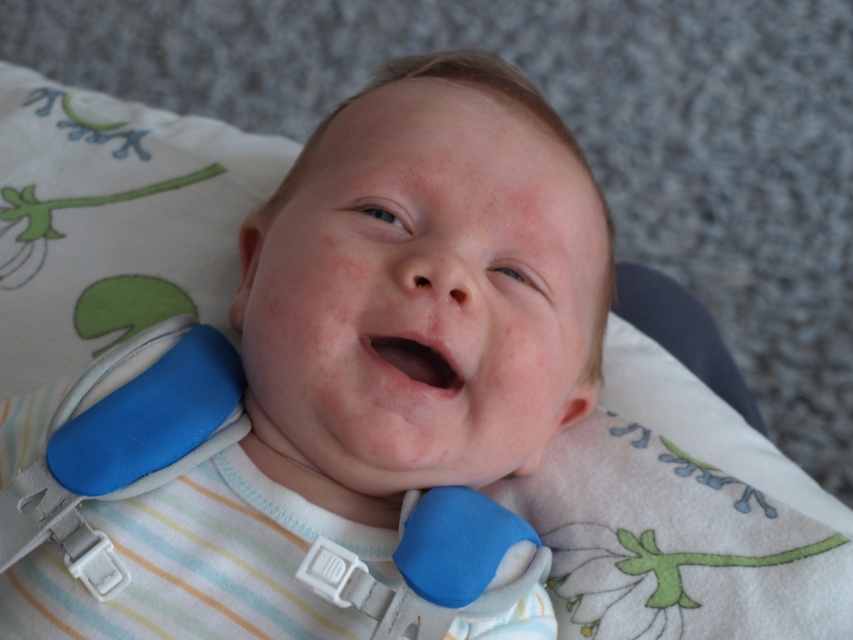
Describe the element at coordinates (366, 358) in the screenshot. I see `blue foam baby at center` at that location.

Which is in front, point (399, 99) or point (192, 344)?

Positioned in front is point (399, 99).

Which is in front, point (300, 288) or point (160, 404)?

Point (300, 288)

Find the location of a particular element. blue foam baby at center is located at coordinates (366, 358).

Is blue foam strap at center thinner than smooth pink flesh at center?

In fact, blue foam strap at center might be wider than smooth pink flesh at center.

Is blue foam strap at center below smooth pink flesh at center?

Yes.

Image resolution: width=853 pixels, height=640 pixels. I want to click on blue foam strap at center, so click(123, 444).

Is blue foam baby at center shorter than smooth pink flesh at center?

In fact, blue foam baby at center may be taller than smooth pink flesh at center.

Does blue foam baby at center have a smaller size compared to smooth pink flesh at center?

No, blue foam baby at center is not smaller than smooth pink flesh at center.

Is point (579, 237) positioned in front of point (424, 358)?

No, (579, 237) is behind (424, 358).

Find the location of `blue foam baby at center`. blue foam baby at center is located at coordinates (366, 358).